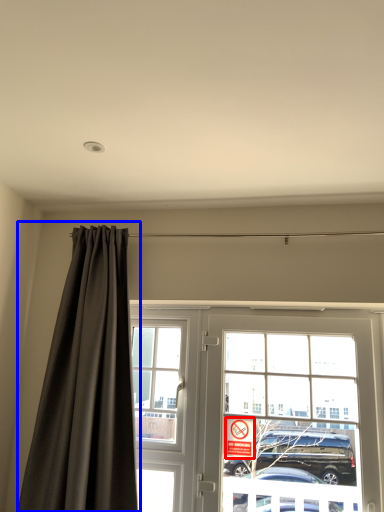
Question: Which object is closer to the camera taking this photo, parking sign (highlighted by a red box) or curtain (highlighted by a blue box)?

Choices:
 (A) parking sign
 (B) curtain

Answer: (B)